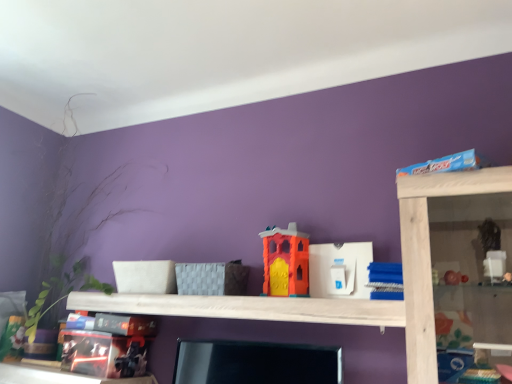
Question: Choose the correct answer: Is white wood shelf at center inside green leafy plant at left or outside it?

Choices:
 (A) inside
 (B) outside

Answer: (B)

Question: Is white wood shelf at center taller or shorter than green leafy plant at left?

Choices:
 (A) tall
 (B) short

Answer: (B)

Question: Which object is the farthest from the blue plastic toy at upper right, arranged as the fourth toy when viewed from the left?

Choices:
 (A) white plastic toy at center, marked as the 2th toy in a right-to-left arrangement
 (B) orange matte plastic toy at center, acting as the third toy starting from the right
 (C) green leafy plant at left
 (D) matt black toy at lower left, the fourth toy in the right-to-left sequence
 (E) white wood shelf at center

Answer: (C)

Question: Which is nearer to the white plastic toy at center, marked as the 2th toy in a right-to-left arrangement?

Choices:
 (A) white wood shelf at center
 (B) orange matte plastic toy at center, acting as the third toy starting from the right
 (C) blue plastic toy at upper right, the 1th toy viewed from the right
 (D) matt black toy at lower left, the fourth toy in the right-to-left sequence
 (E) green leafy plant at left

Answer: (B)